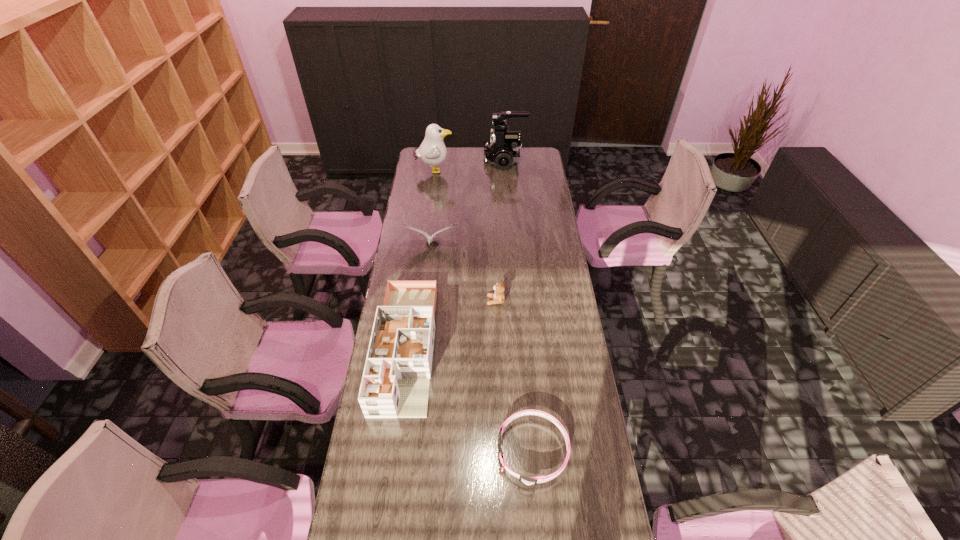
Where is `vacant space that satisfies the following two spatial constraints: 1. on the front-facing side of the teddy bear; 2. at the entrance of the dollhouse`? This screenshot has width=960, height=540. vacant space that satisfies the following two spatial constraints: 1. on the front-facing side of the teddy bear; 2. at the entrance of the dollhouse is located at coordinates (497, 347).

Where is `free space that satisfies the following two spatial constraints: 1. on the front-facing side of the teddy bear; 2. at the entrance of the dollhouse`? free space that satisfies the following two spatial constraints: 1. on the front-facing side of the teddy bear; 2. at the entrance of the dollhouse is located at coordinates (497, 347).

The width and height of the screenshot is (960, 540). I want to click on blank area in the image that satisfies the following two spatial constraints: 1. on the lens mount of the camcorder; 2. at the tip of the beak of the shorter gull, so click(511, 246).